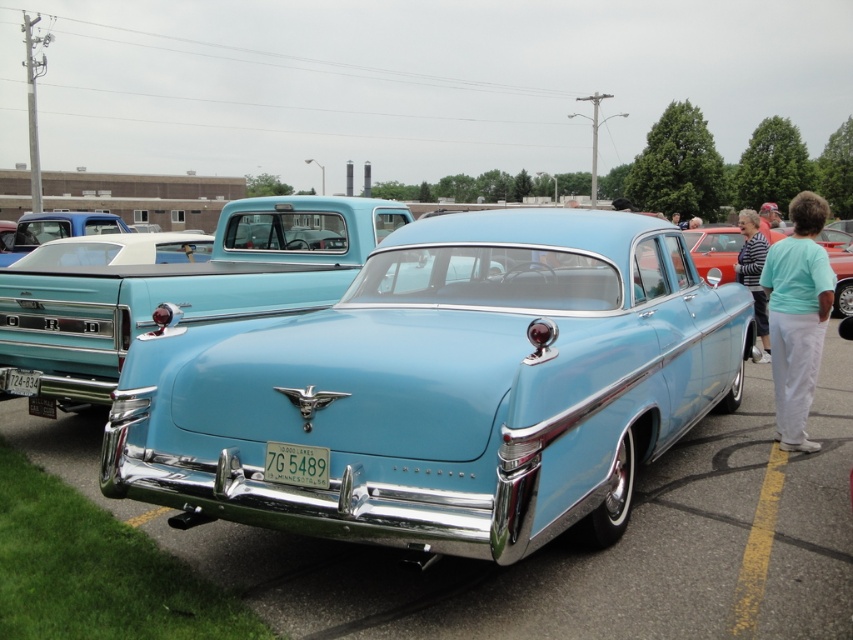
Who is higher up, yellow painted line at lower right or light blue glossy sedan at center?

Positioned higher is light blue glossy sedan at center.

Looking at this image, who is positioned more to the right, yellow painted line at lower right or light blue glossy sedan at center?

light blue glossy sedan at center

Which is in front, point (764, 557) or point (711, 227)?

Positioned in front is point (764, 557).

This screenshot has width=853, height=640. What are the coordinates of `yellow painted line at lower right` in the screenshot? It's located at (757, 550).

Does point (793, 237) come closer to viewer compared to point (741, 573)?

No.

Does point (801, 342) come behind point (740, 564)?

Yes, point (801, 342) is behind point (740, 564).

Between point (825, 310) and point (749, 545), which one is positioned behind?

The point (825, 310) is behind.

Identify the location of light blue cotton pants at right. The image size is (853, 640). (798, 316).

Is light blue cotton pants at right further to the viewer compared to striped fabric shirt at center?

No, it is not.

Can you confirm if light blue cotton pants at right is positioned above striped fabric shirt at center?

Actually, light blue cotton pants at right is below striped fabric shirt at center.

Measure the distance between point (764, 275) and camera.

Point (764, 275) is 5.76 meters away from camera.

Where is `light blue cotton pants at right`? This screenshot has width=853, height=640. light blue cotton pants at right is located at coordinates (798, 316).